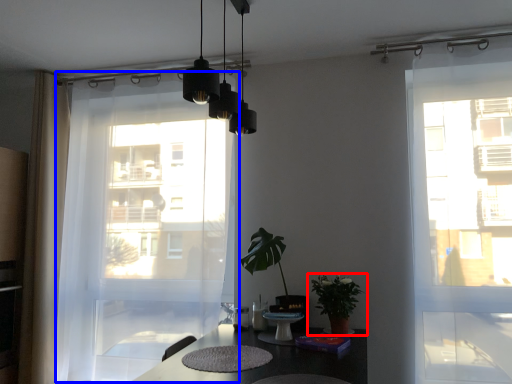
Question: Which object is closer to the camera taking this photo, houseplant (highlighted by a red box) or curtain (highlighted by a blue box)?

Choices:
 (A) houseplant
 (B) curtain

Answer: (A)